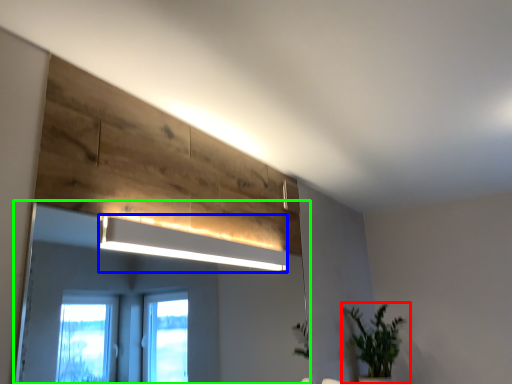
Question: Which object is positioned closest to houseplant (highlighted by a red box)? Select from lamp (highlighted by a blue box) and mirror (highlighted by a green box).

Choices:
 (A) lamp
 (B) mirror

Answer: (A)